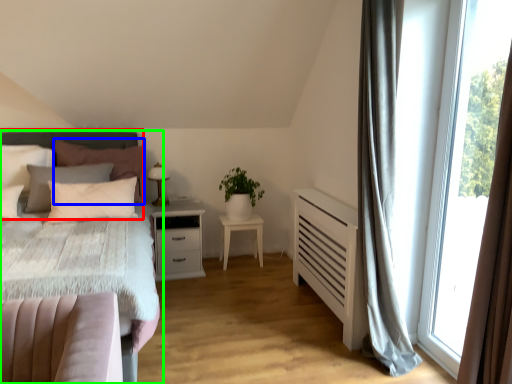
Question: Estimate the real-world distances between objects in this image. Which object is closer to headboard (highlighted by a red box), pillow (highlighted by a blue box) or bed (highlighted by a green box)?

Choices:
 (A) pillow
 (B) bed

Answer: (B)